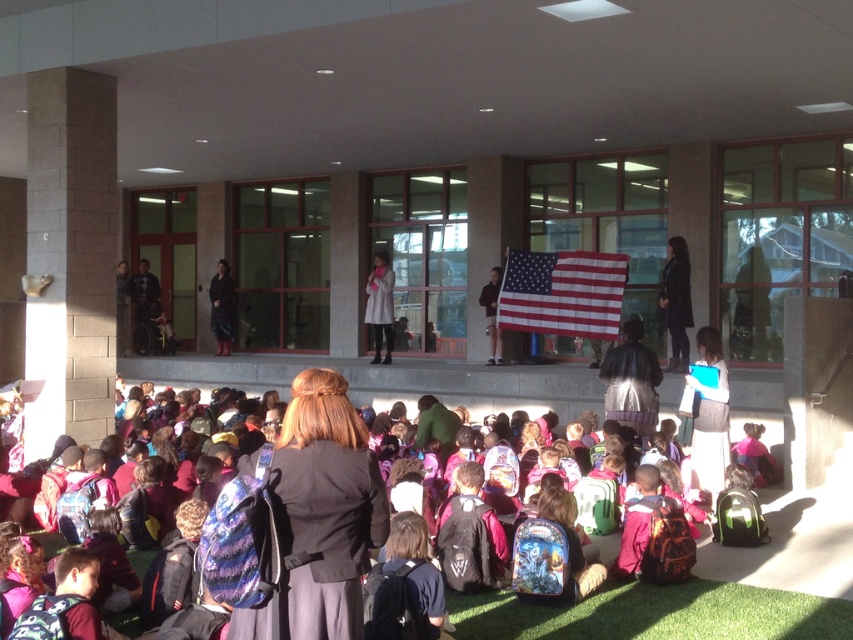
Is multicolored backpacks at lower center below black leather jacket at center?

Correct, multicolored backpacks at lower center is located below black leather jacket at center.

The width and height of the screenshot is (853, 640). What do you see at coordinates (628, 612) in the screenshot?
I see `multicolored backpacks at lower center` at bounding box center [628, 612].

Locate an element on the screen. The image size is (853, 640). multicolored backpacks at lower center is located at coordinates (x=628, y=612).

Between matte black backpack at center and dark gray sweater at lower right, which one is positioned higher?

matte black backpack at center is higher up.

Does matte black backpack at center have a larger size compared to dark gray sweater at lower right?

Actually, matte black backpack at center might be smaller than dark gray sweater at lower right.

The height and width of the screenshot is (640, 853). Find the location of `matte black backpack at center`. matte black backpack at center is located at coordinates (320, 515).

Identify the location of matte black backpack at center. This screenshot has height=640, width=853. (320, 515).

Who is positioned more to the right, red/white striped fabric flag at center or dark gray sweater at lower right?

From the viewer's perspective, dark gray sweater at lower right appears more on the right side.

Is red/white striped fabric flag at center bigger than dark gray sweater at lower right?

Indeed, red/white striped fabric flag at center has a larger size compared to dark gray sweater at lower right.

Between point (604, 284) and point (715, 422), which one is positioned in front?

Positioned in front is point (715, 422).

Image resolution: width=853 pixels, height=640 pixels. I want to click on red/white striped fabric flag at center, so [561, 292].